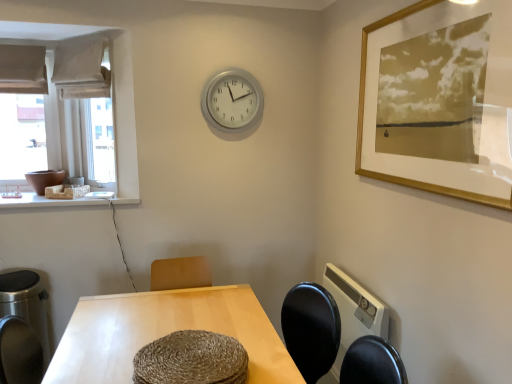
Question: Can you confirm if light wood table at center is wider than gold framed print at upper right?

Choices:
 (A) no
 (B) yes

Answer: (B)

Question: Can you confirm if light wood table at center is shorter than gold framed print at upper right?

Choices:
 (A) no
 (B) yes

Answer: (B)

Question: Is light wood table at center further to the viewer compared to gold framed print at upper right?

Choices:
 (A) yes
 (B) no

Answer: (A)

Question: Would you consider light wood table at center to be distant from gold framed print at upper right?

Choices:
 (A) yes
 (B) no

Answer: (A)

Question: Can gold framed print at upper right be found inside light wood table at center?

Choices:
 (A) no
 (B) yes

Answer: (A)

Question: From a real-world perspective, is light wood table at center located higher than gold framed print at upper right?

Choices:
 (A) no
 (B) yes

Answer: (A)

Question: Does gold framed print at upper right appear on the right side of white fabric curtain at upper left?

Choices:
 (A) no
 (B) yes

Answer: (B)

Question: Is gold framed print at upper right facing towards white fabric curtain at upper left?

Choices:
 (A) yes
 (B) no

Answer: (B)

Question: Does gold framed print at upper right have a greater width compared to white fabric curtain at upper left?

Choices:
 (A) no
 (B) yes

Answer: (A)

Question: Does gold framed print at upper right have a larger size compared to white fabric curtain at upper left?

Choices:
 (A) yes
 (B) no

Answer: (A)

Question: Does gold framed print at upper right have a lesser width compared to white fabric curtain at upper left?

Choices:
 (A) no
 (B) yes

Answer: (B)

Question: Is gold framed print at upper right with white fabric curtain at upper left?

Choices:
 (A) yes
 (B) no

Answer: (B)

Question: Is white fabric curtain at upper left at the back of silver metallic clock at upper center?

Choices:
 (A) yes
 (B) no

Answer: (B)